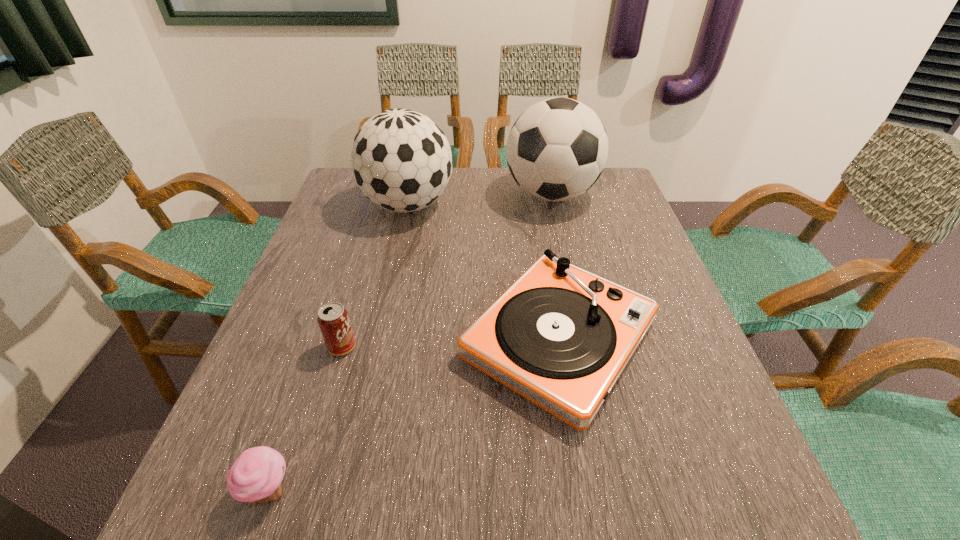
Where is `vacant region at the near edge`? The width and height of the screenshot is (960, 540). vacant region at the near edge is located at coordinates (381, 505).

Where is `free space at the left edge`? free space at the left edge is located at coordinates [x=300, y=299].

Locate an element on the screen. Image resolution: width=960 pixels, height=540 pixels. blank space at the right edge of the desktop is located at coordinates (684, 380).

This screenshot has width=960, height=540. I want to click on blank space at the far left corner of the desktop, so click(379, 208).

Where is `free space that is in between the left soccer ball and the record player`? Image resolution: width=960 pixels, height=540 pixels. free space that is in between the left soccer ball and the record player is located at coordinates (484, 272).

Find the location of a particular element. The width and height of the screenshot is (960, 540). free point between the soda can and the record player is located at coordinates (450, 343).

Image resolution: width=960 pixels, height=540 pixels. Identify the location of empty location between the soda can and the nearest object. (305, 418).

Find the location of a particular element. The height and width of the screenshot is (540, 960). free space that is in between the left soccer ball and the record player is located at coordinates (484, 272).

You are a GUI agent. You are given a task and a screenshot of the screen. Output one action in this format:
    pyautogui.click(x=<x>, y=<y>)
    Task: Click on the vacant area that lies between the nearest object and the right soccer ball
    This screenshot has height=540, width=960.
    Given the screenshot: What is the action you would take?
    (x=410, y=342)

I want to click on vacant region between the soda can and the record player, so click(450, 343).